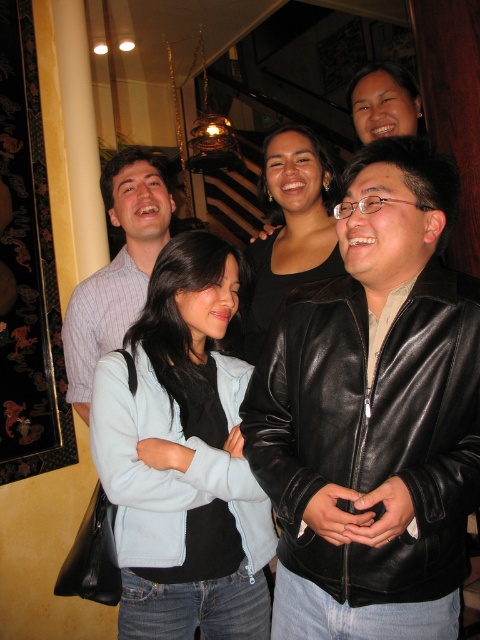
Does light blue fabric at center appear on the right side of black leather jacket at center?

In fact, light blue fabric at center is to the left of black leather jacket at center.

Does light blue fabric at center appear under black leather jacket at center?

Indeed, light blue fabric at center is positioned under black leather jacket at center.

Who is more distant from viewer, [252,593] or [243,323]?

Point [243,323]

The image size is (480, 640). What are the coordinates of `light blue fabric at center` in the screenshot? It's located at (182, 458).

Between black leather jacket at lower right and black leather jacket at center, which one appears on the left side from the viewer's perspective?

Positioned to the left is black leather jacket at center.

Is black leather jacket at lower right bigger than black leather jacket at center?

Incorrect, black leather jacket at lower right is not larger than black leather jacket at center.

Who is more forward, (x=325, y=396) or (x=324, y=275)?

Point (x=325, y=396) is more forward.

Locate an element on the screen. This screenshot has height=640, width=480. black leather jacket at lower right is located at coordinates (372, 429).

Which of these two, light blue fabric at center or striped cotton shirt at left, stands taller?

light blue fabric at center

In the scene shown: Between light blue fabric at center and striped cotton shirt at left, which one appears on the right side from the viewer's perspective?

From the viewer's perspective, light blue fabric at center appears more on the right side.

Between point (269, 611) and point (87, 401), which one is positioned in front?

Point (269, 611)

I want to click on light blue fabric at center, so click(182, 458).